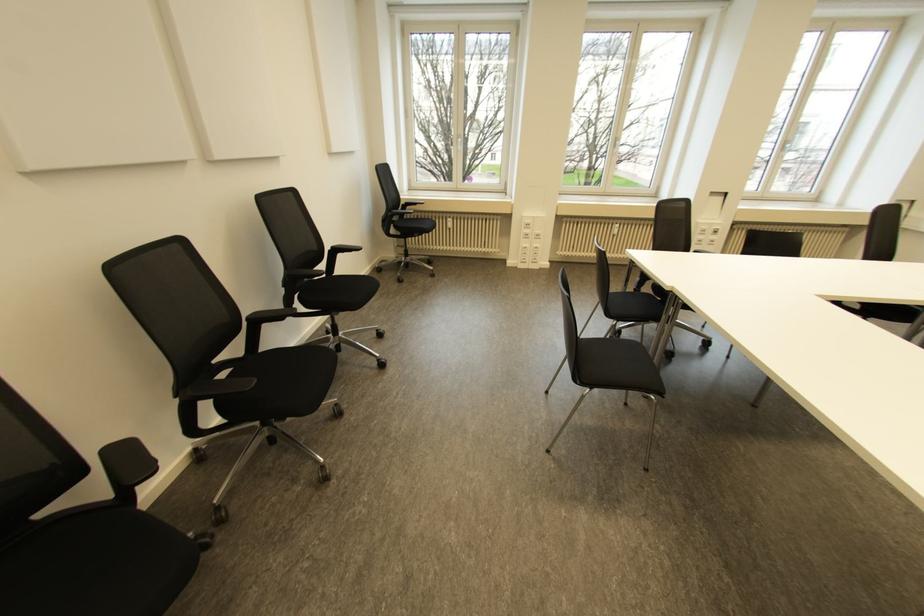
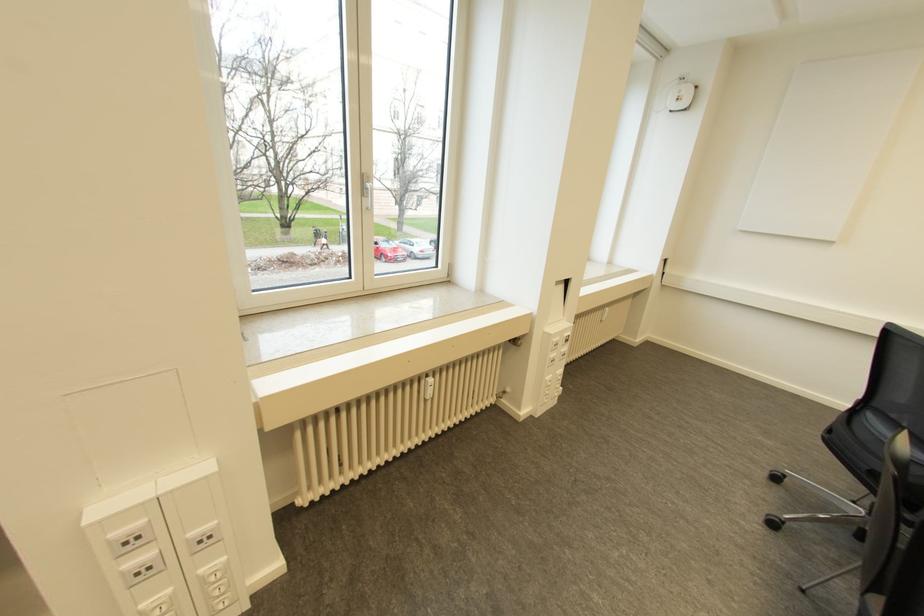
Locate, in the second image, the point that corresponds to (616,225) in the first image.

(430, 379)